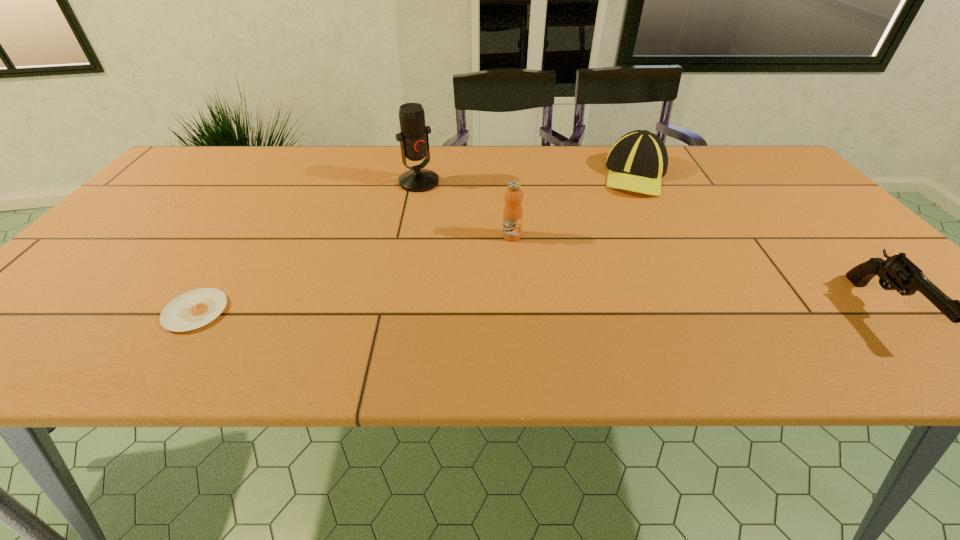
Identify which object is located as the third nearest to the baseball cap. Please provide its 2D coordinates. Your answer should be formatted as a tuple, i.e. [(x, y)], where the tuple contains the x and y coordinates of a point satisfying the conditions above.

[(414, 142)]

At what (x,y) coordinates should I click in order to perform the action: click on object identified as the closest to the fourth object from left to right. Please return your answer as a coordinate pair (x, y). Looking at the image, I should click on (512, 214).

In order to click on vacant point that satisfies the following two spatial constraints: 1. on the back side of the leftmost object; 2. on the left side of the baseball cap in this screenshot , I will do `click(285, 175)`.

Locate an element on the screen. vacant space that satisfies the following two spatial constraints: 1. on the back side of the microphone; 2. on the left side of the second object from right to left is located at coordinates (420, 175).